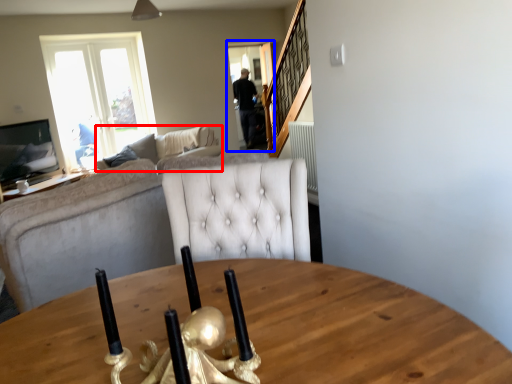
Question: Which of the following is the closest to the observer, studio couch (highlighted by a red box) or glass door (highlighted by a blue box)?

Choices:
 (A) studio couch
 (B) glass door

Answer: (A)